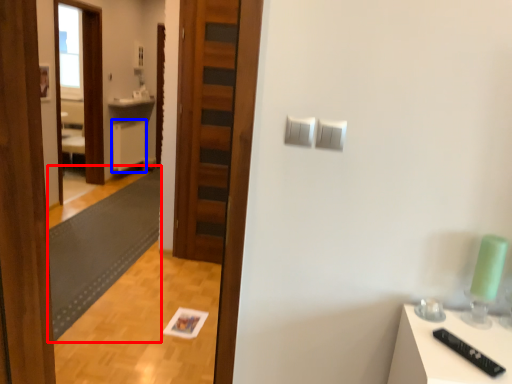
Question: Which point is closer to the camera, mat (highlighted by a red box) or cabinetry (highlighted by a blue box)?

Choices:
 (A) mat
 (B) cabinetry

Answer: (A)